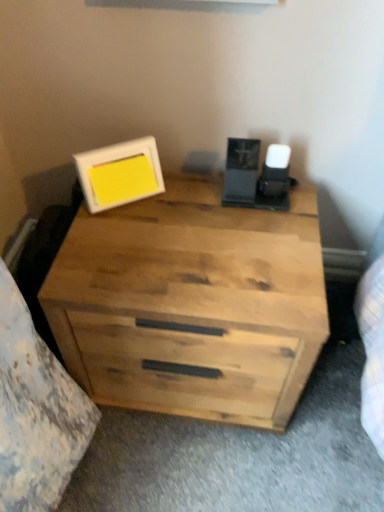
Where is `vacant point above natural wood chest of drawers at center (from a real-world perspective)`? The width and height of the screenshot is (384, 512). vacant point above natural wood chest of drawers at center (from a real-world perspective) is located at coordinates (203, 237).